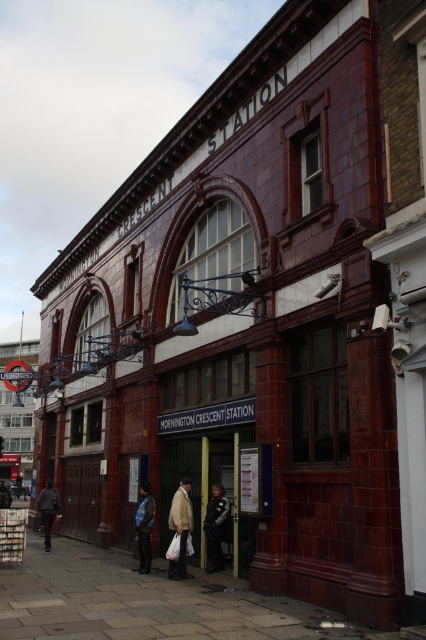
In the scene shown: Who is higher up, dark gray jacket at lower left or dark blue jacket at center?

dark gray jacket at lower left is above.

Locate an element on the screen. The width and height of the screenshot is (426, 640). dark gray jacket at lower left is located at coordinates (48, 509).

Identify the location of dark gray jacket at lower left. (48, 509).

Can you confirm if dark blue uniform at center is shorter than blue reflective jacket at center?

No.

Between dark blue uniform at center and blue reflective jacket at center, which one is positioned lower?

Positioned lower is blue reflective jacket at center.

The image size is (426, 640). Describe the element at coordinates (215, 528) in the screenshot. I see `dark blue uniform at center` at that location.

Where is `dark blue uniform at center`? This screenshot has width=426, height=640. dark blue uniform at center is located at coordinates (215, 528).

Which of these two, light beige jacket at center or dark gray jacket at lower left, stands taller?

dark gray jacket at lower left

Can you confirm if light beige jacket at center is positioned below dark gray jacket at lower left?

No.

Identify the location of light beige jacket at center. This screenshot has width=426, height=640. (181, 528).